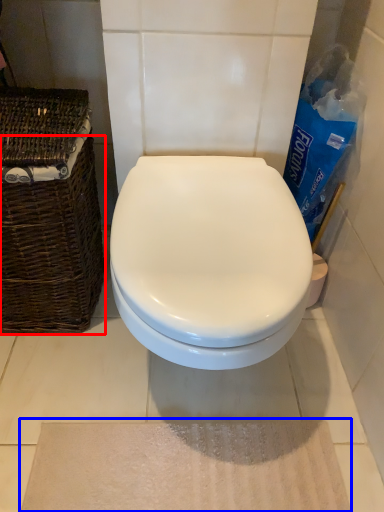
Question: Among these objects, which one is nearest to the camera, basket (highlighted by a red box) or bath mat (highlighted by a blue box)?

Choices:
 (A) basket
 (B) bath mat

Answer: (A)